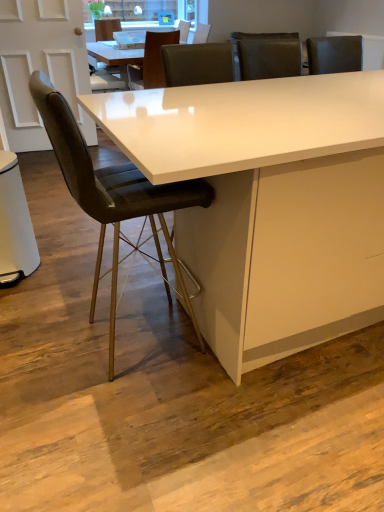
Where is `free spot to the left of leather-like black chair at left, positioned as the first chair in bottom-to-top order`? Image resolution: width=384 pixels, height=512 pixels. free spot to the left of leather-like black chair at left, positioned as the first chair in bottom-to-top order is located at coordinates (49, 334).